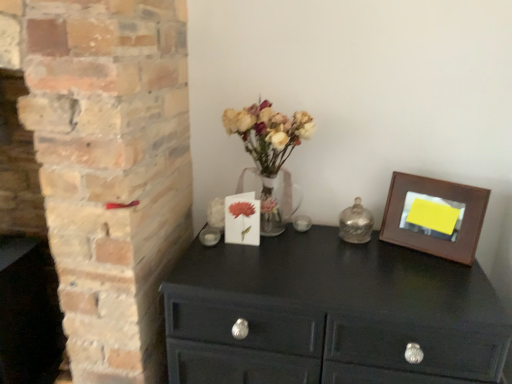
You are a GUI agent. You are given a task and a screenshot of the screen. Output one action in this format:
    pyautogui.click(x=<x>, y=<y>)
    Task: Click on the vacant space situated on the left part of shiny metallic bell at center-right
    
    Given the screenshot: What is the action you would take?
    pyautogui.click(x=307, y=234)